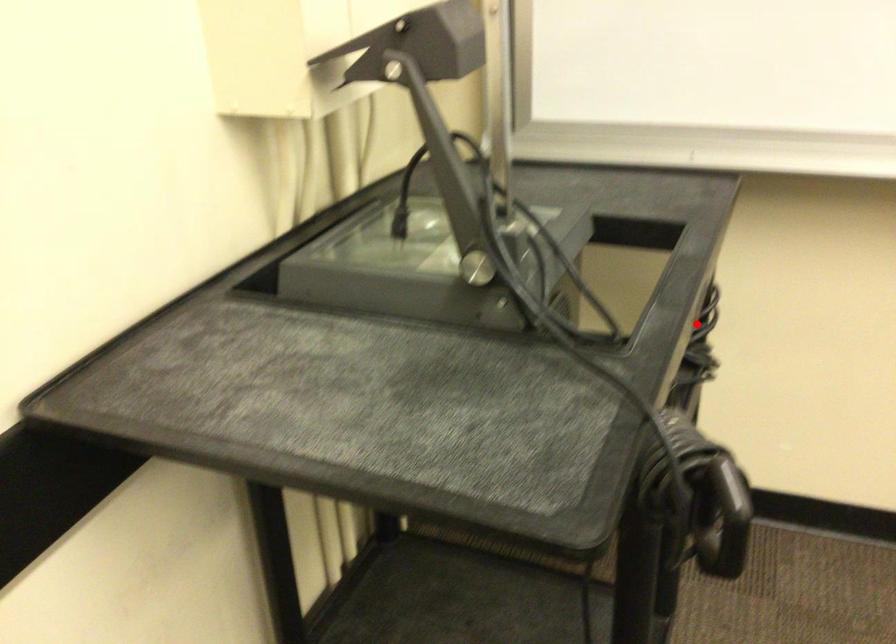
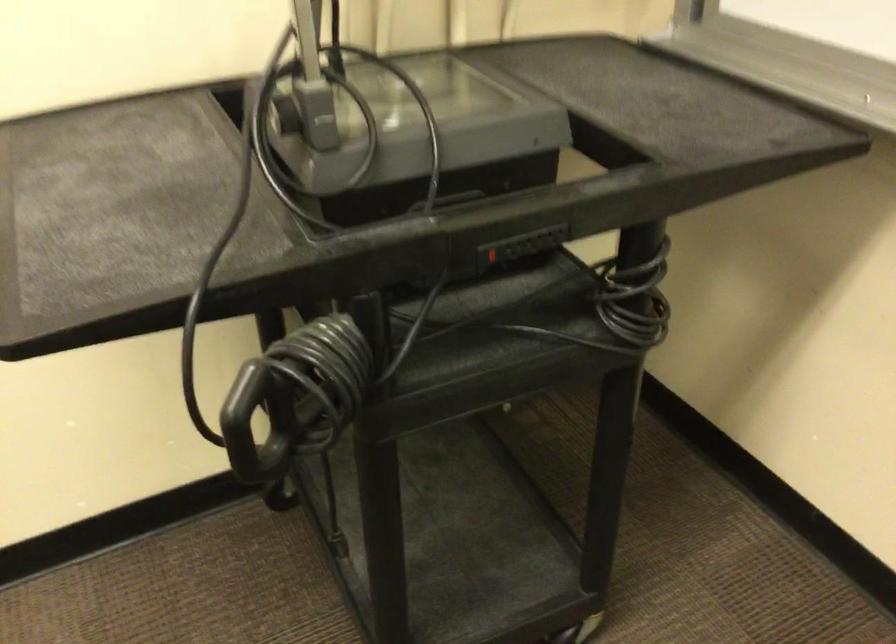
Locate, in the second image, the point that corresponds to the highlighted location in the first image.

(490, 254)